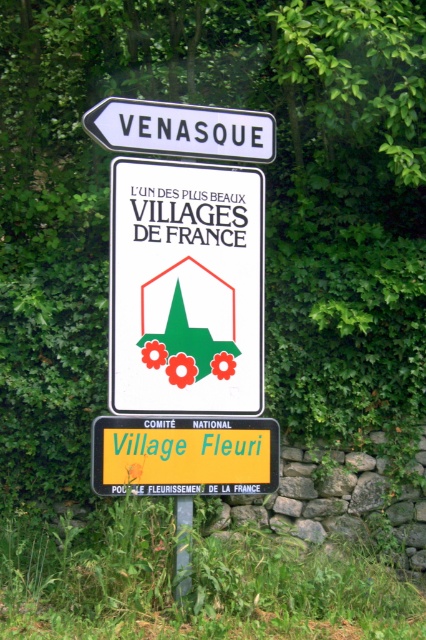
Question: Does yellow plastic sign at center appear on the left side of metallic pole at center?

Choices:
 (A) no
 (B) yes

Answer: (A)

Question: Does white paper sign at upper center appear under yellow plastic sign at center?

Choices:
 (A) no
 (B) yes

Answer: (A)

Question: Which point is farther from the camera taking this photo?

Choices:
 (A) (170, 323)
 (B) (221, 148)
 (C) (146, 448)
 (D) (189, 508)

Answer: (B)

Question: Observing the image, what is the correct spatial positioning of yellow plastic sign at center in reference to metallic pole at center?

Choices:
 (A) left
 (B) right

Answer: (B)

Question: Which of the following is the farthest from the observer?

Choices:
 (A) (118, 472)
 (B) (196, 132)

Answer: (B)

Question: Which point appears closest to the camera in this image?

Choices:
 (A) (232, 477)
 (B) (176, 556)

Answer: (B)